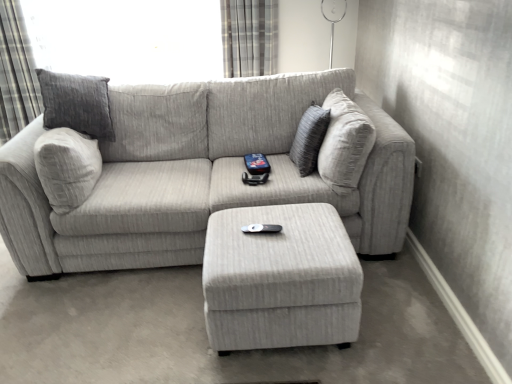
Identify the location of vacant region to the right of black plastic remote at center. (307, 228).